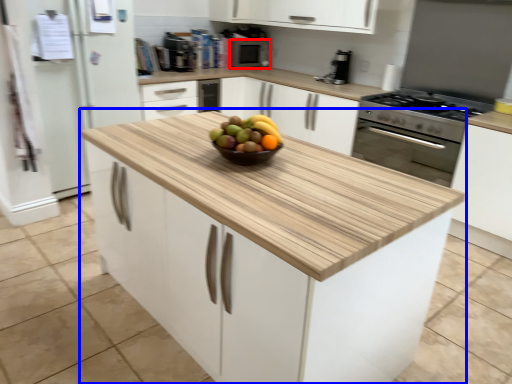
Question: Among these objects, which one is nearest to the camera, appliance (highlighted by a red box) or cabinetry (highlighted by a blue box)?

Choices:
 (A) appliance
 (B) cabinetry

Answer: (B)